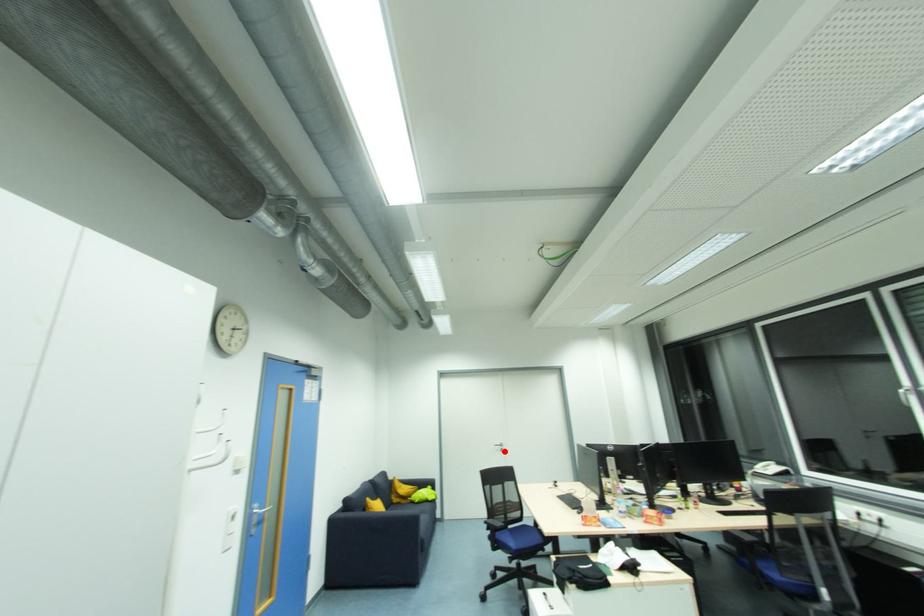
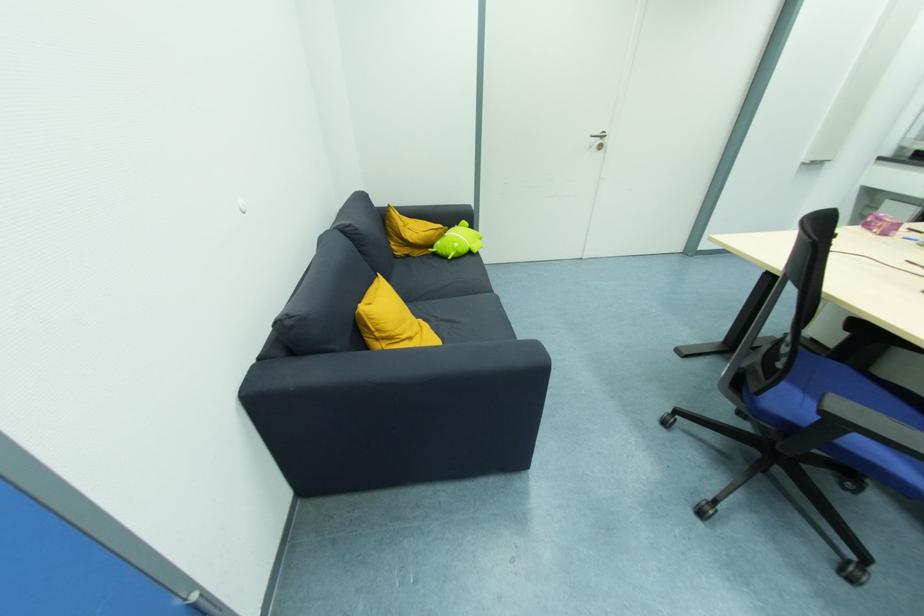
Question: I am providing you with two images of the same scene from different viewpoints. Image1 has a red point marked. In image2, the corresponding 3D location appears at what relative position? Reply with the corresponding letter.

Choices:
 (A) Closer
 (B) Farther

Answer: (A)